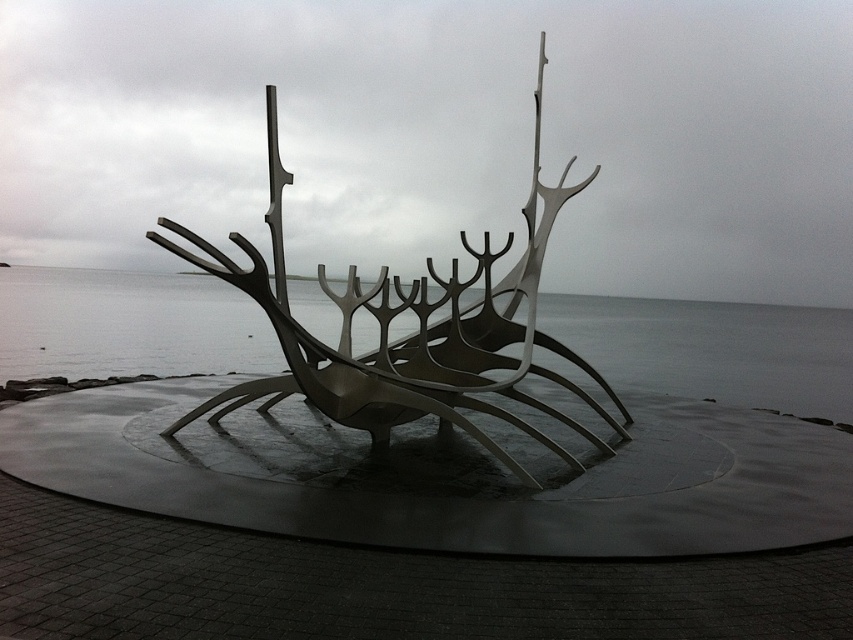
Does point (817, 364) come closer to viewer compared to point (216, 259)?

That is False.

Who is shorter, gray metallic water at center or metallic silver ship at center?

With less height is gray metallic water at center.

Which is in front, point (97, 340) or point (462, 369)?

Point (462, 369) is more forward.

Identify the location of gray metallic water at center. (712, 349).